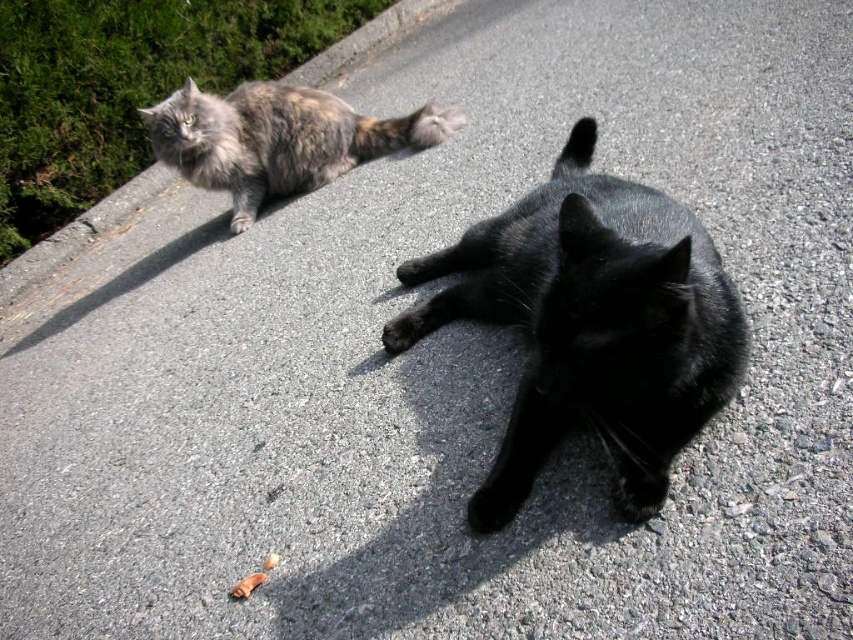
You are a photographer setting up a camera at the center of the driveway. You want to capture both the black glossy cat at center and the tabby fur cat at upper left in a single shot. Which cat will appear smaller in the photo?

The black glossy cat at center will appear smaller in the photo because it has a lesser height compared to the tabby fur cat at upper left.

You are standing at the center of the paved surface and want to find the black glossy cat at center. According to the coordinates provided, in which direction should you look to locate it?

The black glossy cat at center is located at coordinates point (590, 324). Since you are at the center of the paved surface, you should look downward to locate it because the y coordinate 0.693 is below the center point of 0.5 in the vertical axis.

Looking at this image, you are a photographer trying to capture both the black glossy cat at center and the tabby fur cat at upper left in a single frame. Given their sizes, which cat would appear larger in the photo?

The tabby fur cat at upper left would appear larger in the photo because it is bigger in size compared to the black glossy cat at center.